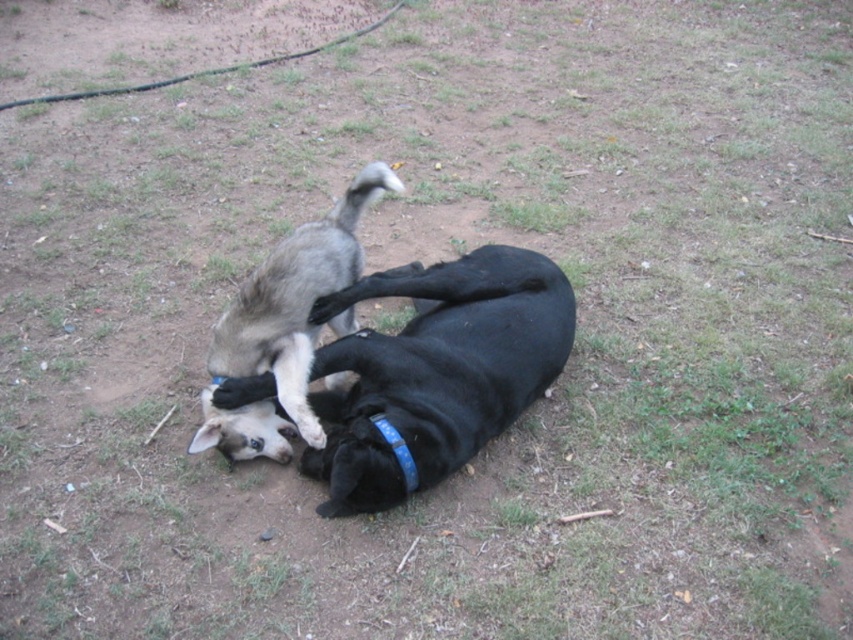
You are a dog owner who wants to ensure the safety of both dogs during play. Given that the black matte dog at center is lying on its back and the gray fur puppy at center is standing on it, which dog is more likely to be able to protect itself if the play becomes too rough?

The black matte dog at center is larger in size compared to the gray fur puppy at center, so it is more capable of protecting itself during rough play.

Consider the image. You are standing in the yard and want to throw a ball to the black matte dog at center. If you can throw the ball 2.5 meters, will it reach the dog?

The black matte dog at center is 2.38 meters away from the viewer. Since the viewer can throw the ball 2.5 meters, which is farther than the distance to the dog, the ball will reach the dog.

You are a dog owner who wants to put a blue plastic neckband at center on your gray fur puppy at center. Can you reach the neckband from where the puppy is currently lying?

The gray fur puppy at center and blue plastic neckband at center are 17.42 inches apart from each other, so yes, you can reach the blue plastic neckband at center from where the gray fur puppy at center is lying since the distance is manageable for an average adult to pick up.